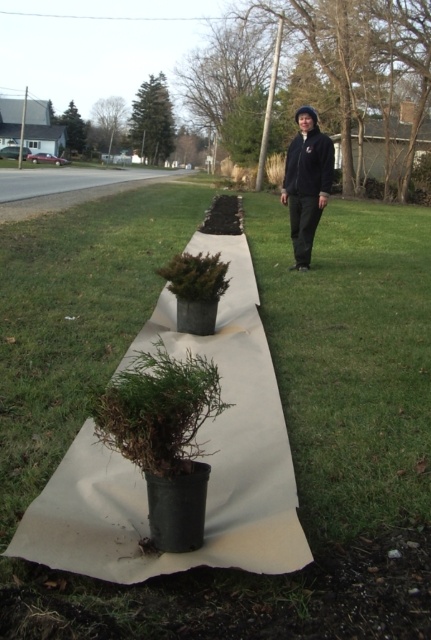
You are standing in the residential area and see the green textured evergreen tree at upper center and the green matte tree at upper center. Which one is positioned to the right side?

The green textured evergreen tree at upper center is positioned to the right of the green matte tree at upper center.